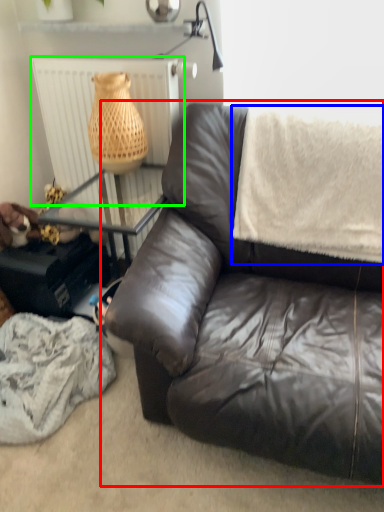
Question: Estimate the real-world distances between objects in this image. Which object is closer to studio couch (highlighted by a red box), blanket (highlighted by a blue box) or radiator (highlighted by a green box)?

Choices:
 (A) blanket
 (B) radiator

Answer: (A)